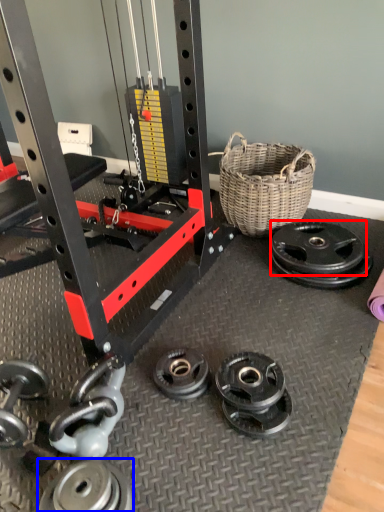
Question: Among these objects, which one is nearest to the camera, wheel (highlighted by a red box) or wheel (highlighted by a blue box)?

Choices:
 (A) wheel
 (B) wheel

Answer: (B)